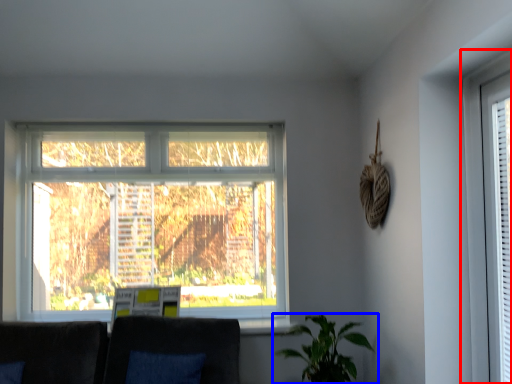
Question: Which object is closer to the camera taking this photo, window (highlighted by a red box) or houseplant (highlighted by a blue box)?

Choices:
 (A) window
 (B) houseplant

Answer: (A)